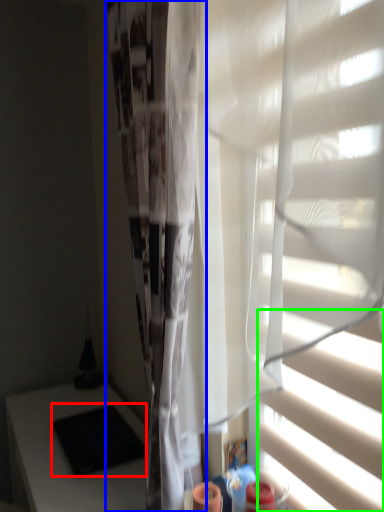
Question: Estimate the real-world distances between objects in this image. Which object is farther from pad (highlighted by a red box), shower curtain (highlighted by a blue box) or blind (highlighted by a green box)?

Choices:
 (A) shower curtain
 (B) blind

Answer: (B)